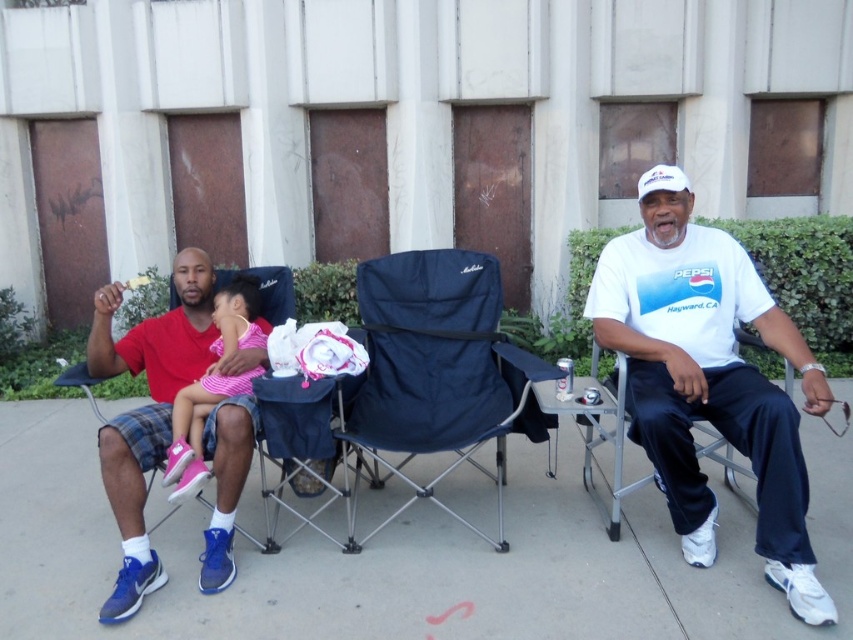
You are standing in the plaza and want to reach a specific point marked at coordinates point (635, 310). If you are currently 3 meters away from that point, can you take a step forward to reach it?

The distance of point (635, 310) from viewer is 2.95 meters, so yes, you can take a step forward since you are currently 3 meters away and the point is slightly closer.